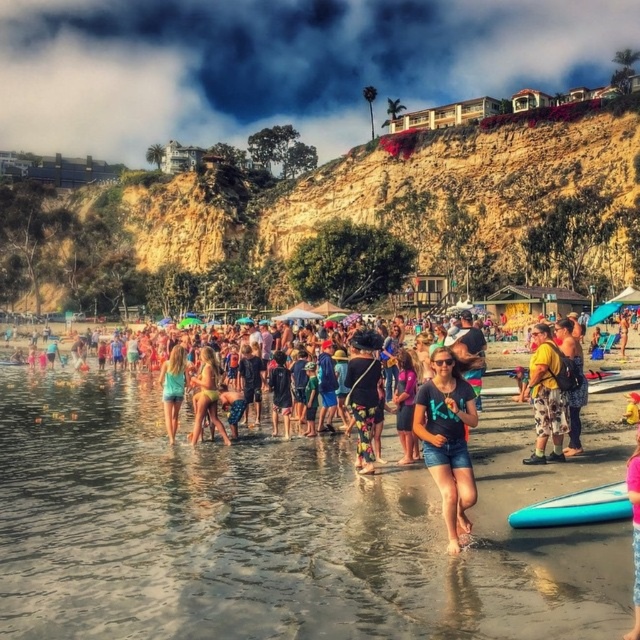
Question: Which object is the closest to the matte blue shorts at center?

Choices:
 (A) floral-patterned shorts at center
 (B) pink fabric shorts at lower right
 (C) blue glossy surfboard at lower center

Answer: (A)

Question: Does matte black t-shirt at center come behind blue glossy surfboard at lower center?

Choices:
 (A) yes
 (B) no

Answer: (A)

Question: Considering the real-world distances, which object is closest to the floral-patterned shorts at center-right?

Choices:
 (A) cliffy sandstone cliff at upper center
 (B) floral-patterned shorts at center
 (C) yellow fabric shorts at center

Answer: (C)

Question: Among these objects, which one is farthest from the camera?

Choices:
 (A) floral-patterned shorts at center-right
 (B) yellow fabric shorts at center
 (C) blue glossy surfboard at lower center

Answer: (A)

Question: Is yellow fabric shorts at center wider than blue glossy surfboard at lower center?

Choices:
 (A) no
 (B) yes

Answer: (B)

Question: Is blue glossy surfboard at lower center further to camera compared to matte blue shorts at center?

Choices:
 (A) no
 (B) yes

Answer: (A)